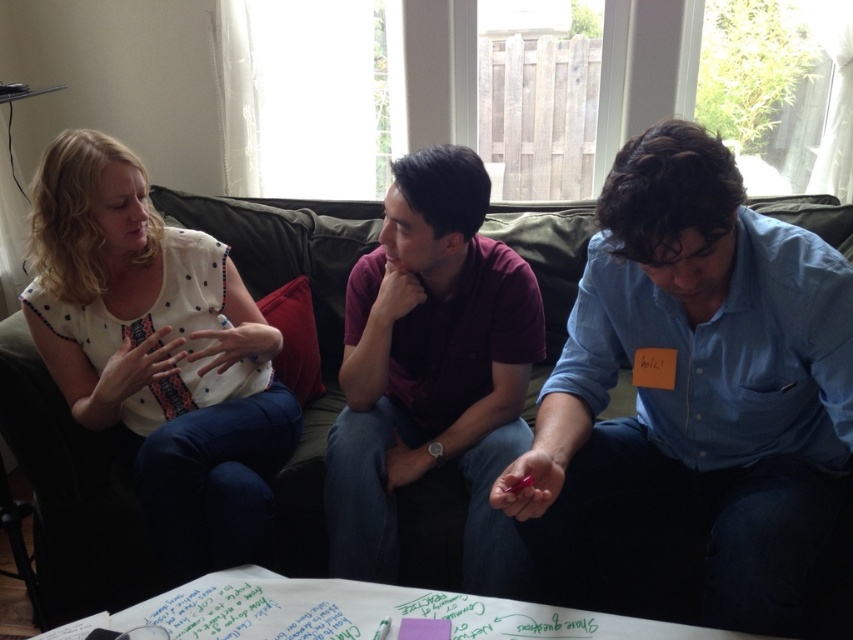
Can you confirm if blue cotton shirt at center is thinner than maroon polo shirt at center?

Incorrect, blue cotton shirt at center's width is not less than maroon polo shirt at center's.

Does point (703, 595) lie in front of point (384, 422)?

Yes, point (703, 595) is in front of point (384, 422).

Find the location of a particular element. The width and height of the screenshot is (853, 640). blue cotton shirt at center is located at coordinates (699, 381).

Measure the distance between point (49, 438) and camera.

Point (49, 438) and camera are 5.54 feet apart from each other.

Which is more to the left, green fabric couch at center or maroon polo shirt at center?

From the viewer's perspective, green fabric couch at center appears more on the left side.

This screenshot has width=853, height=640. I want to click on green fabric couch at center, so click(x=71, y=492).

Where is `green fabric couch at center`? The width and height of the screenshot is (853, 640). green fabric couch at center is located at coordinates (71, 492).

Who is positioned more to the left, blue cotton shirt at center or green fabric couch at center?

Positioned to the left is green fabric couch at center.

Which is behind, point (715, 362) or point (543, 372)?

Positioned behind is point (543, 372).

From the picture: Measure the distance between blue cotton shirt at center and camera.

A distance of 37.05 inches exists between blue cotton shirt at center and camera.

Identify the location of blue cotton shirt at center. Image resolution: width=853 pixels, height=640 pixels. (699, 381).